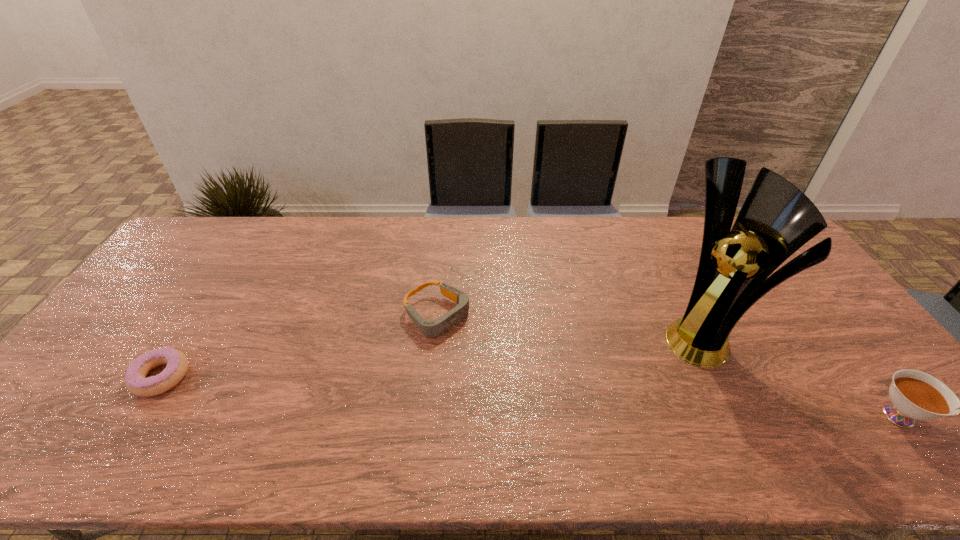
Where is `the leftmost object`? This screenshot has height=540, width=960. the leftmost object is located at coordinates (136, 382).

At what (x,y) coordinates should I click in order to perform the action: click on the third shortest object. Please return your answer as a coordinate pair (x, y). This screenshot has height=540, width=960. Looking at the image, I should click on (916, 395).

This screenshot has width=960, height=540. Identify the location of teacup. (916, 395).

Locate an element on the screen. the second object from right to left is located at coordinates (776, 219).

The height and width of the screenshot is (540, 960). Identify the location of the tallest object. (776, 219).

Identify the location of the second object from left to right. (430, 327).

I want to click on vacant space located 0.330m on the right of the leftmost object, so click(318, 376).

You are a GUI agent. You are given a task and a screenshot of the screen. Output one action in this format:
    pyautogui.click(x=<x>, y=<y>)
    Task: Click on the vacant space situated 0.150m at the front of the second object from right to left, where the globe is visible
    
    Given the screenshot: What is the action you would take?
    pyautogui.click(x=645, y=389)

Image resolution: width=960 pixels, height=540 pixels. What are the coordinates of `vacant space located at the front of the second object from right to left, where the globe is visible` in the screenshot? It's located at (669, 369).

The height and width of the screenshot is (540, 960). I want to click on vacant space located at the front of the second object from right to left, where the globe is visible, so click(x=635, y=398).